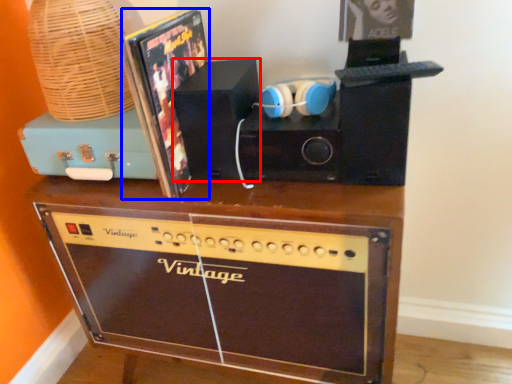
Question: Which of the following is the farthest to the observer, speaker (highlighted by a red box) or album cover (highlighted by a blue box)?

Choices:
 (A) speaker
 (B) album cover

Answer: (A)